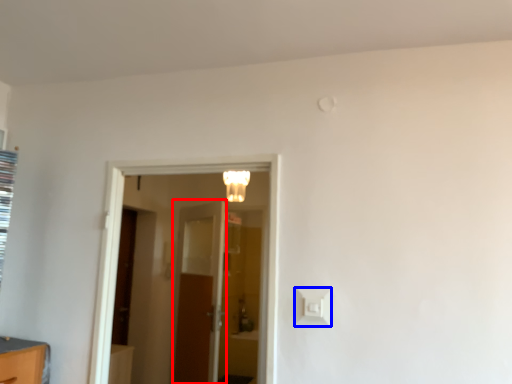
Question: Which point is closer to the camera, door (highlighted by a red box) or light switch (highlighted by a blue box)?

Choices:
 (A) door
 (B) light switch

Answer: (B)